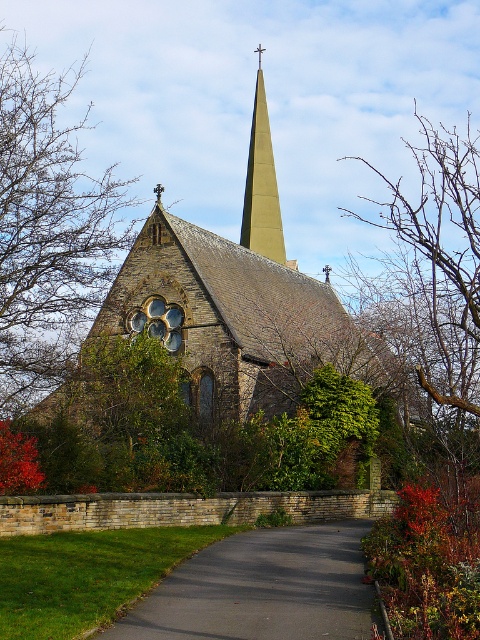
Is point (260, 566) behind point (441, 400)?

Yes.

Image resolution: width=480 pixels, height=640 pixels. I want to click on black asphalt path at center, so click(x=262, y=589).

Is green leafy tree at left thinner than bare branches at upper center?

Correct, green leafy tree at left's width is less than bare branches at upper center's.

Who is more distant from viewer, (71, 259) or (435, 337)?

Positioned behind is point (435, 337).

Find the location of `green leafy tree at left`. green leafy tree at left is located at coordinates (48, 230).

Is point (110, 275) positioned after point (262, 252)?

No, (110, 275) is in front of (262, 252).

What are the coordinates of `green leafy tree at left` in the screenshot? It's located at (48, 230).